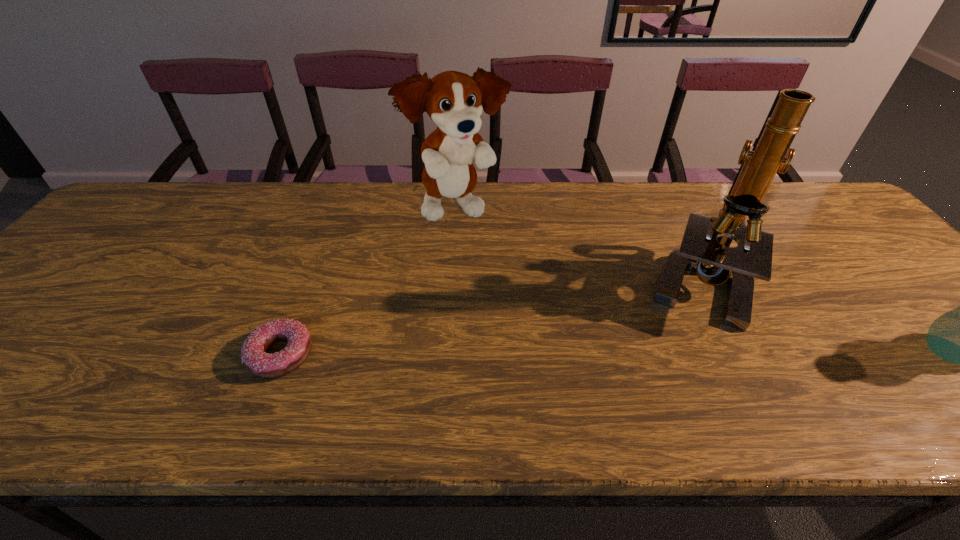
Locate an element on the screen. This screenshot has width=960, height=540. free space on the desktop that is between the doughnut and the second shortest object and is positioned at the eyepiece of the microscope is located at coordinates (610, 353).

Where is `free spot on the desktop that is between the shortest object and the third tallest object and is positioned on the face of the puppy`? Image resolution: width=960 pixels, height=540 pixels. free spot on the desktop that is between the shortest object and the third tallest object and is positioned on the face of the puppy is located at coordinates (601, 353).